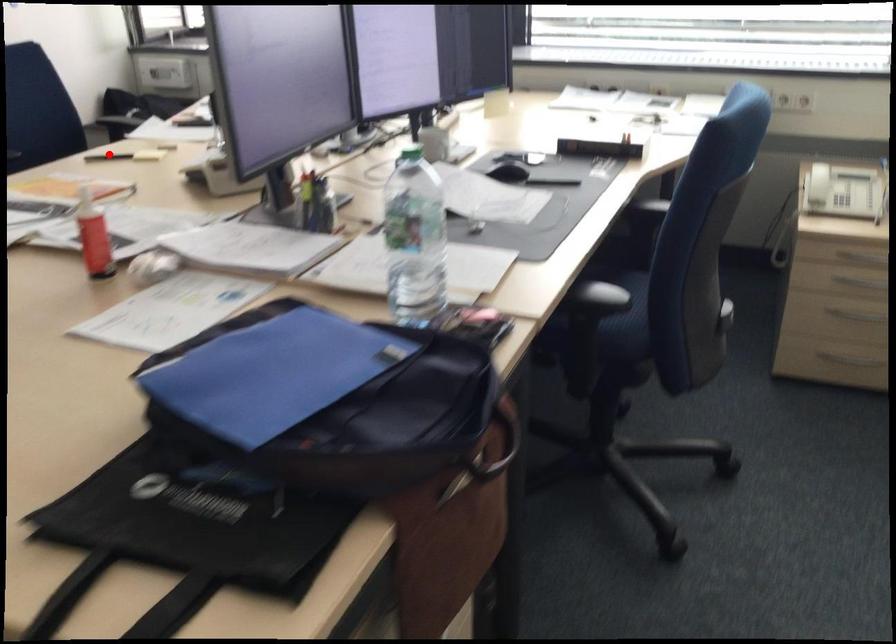
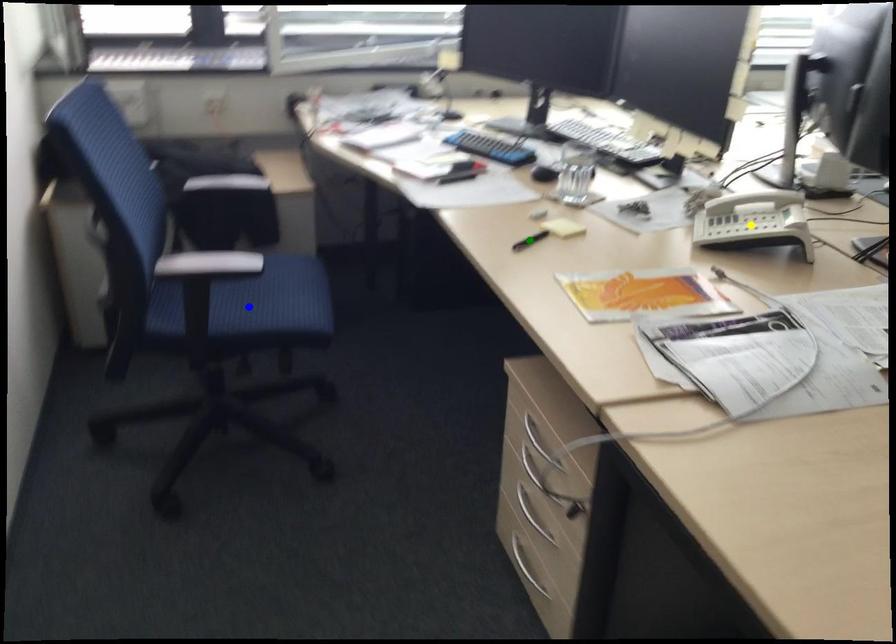
Question: I am providing you with two images of the same scene from different viewpoints. A red point is marked on the first image. You are given multiple points on the second image. Which point in image 2 is actually the same real-world point as the red point in image 1?

Choices:
 (A) yellow point
 (B) blue point
 (C) green point

Answer: (C)